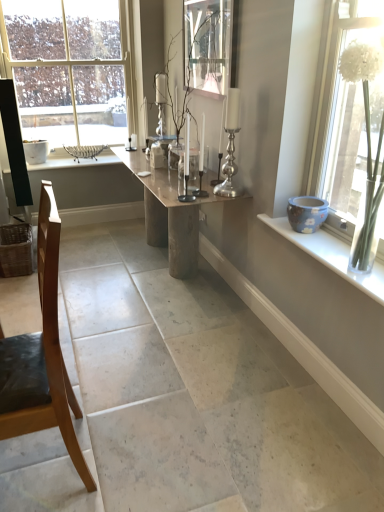
What are the coordinates of `free space to the back side of light wood chair at left` in the screenshot? It's located at (102, 393).